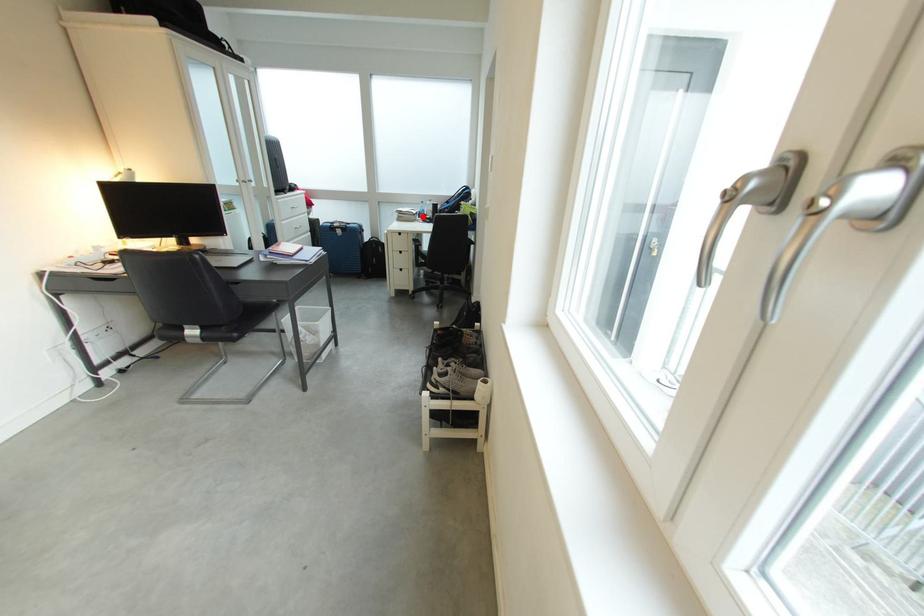
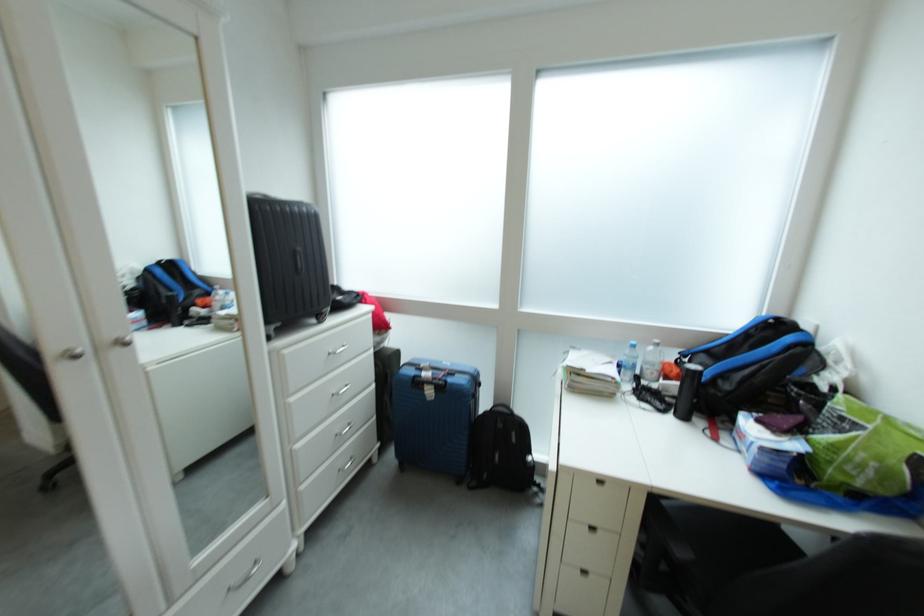
In the second image, find the point that corresponds to the highlighted location in the first image.

(622, 383)